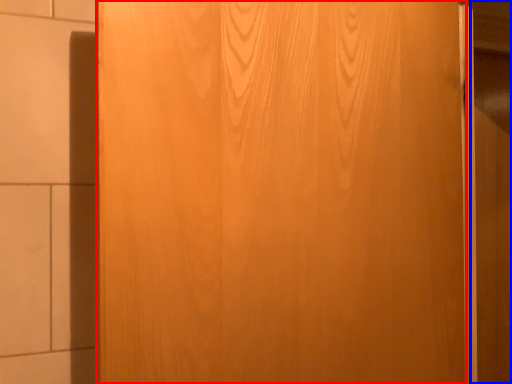
Question: Among these objects, which one is nearest to the camera, door (highlighted by a red box) or barn door (highlighted by a blue box)?

Choices:
 (A) door
 (B) barn door

Answer: (A)